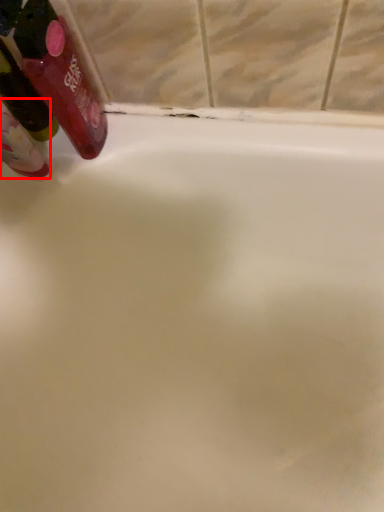
Question: From the image's perspective, what is the correct spatial relationship of mouthwash (annotated by the red box) in relation to mouthwash?

Choices:
 (A) above
 (B) below

Answer: (B)